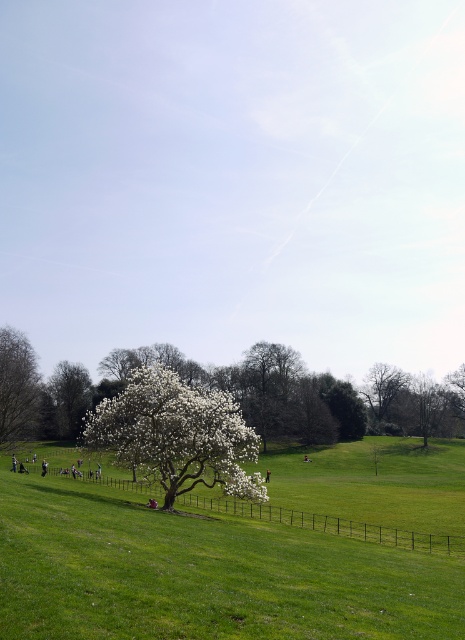
Does white textured tree at center-left have a lesser height compared to bare branches tree at upper right?

In fact, white textured tree at center-left may be taller than bare branches tree at upper right.

Does white textured tree at center-left have a larger size compared to bare branches tree at upper right?

No, white textured tree at center-left is not bigger than bare branches tree at upper right.

You are a GUI agent. You are given a task and a screenshot of the screen. Output one action in this format:
    pyautogui.click(x=<x>, y=<y>)
    Task: Click on the white textured tree at center-left
    
    Given the screenshot: What is the action you would take?
    pyautogui.click(x=70, y=396)

Is point (123, 394) positioned behind point (34, 408)?

Yes, it is behind point (34, 408).

Who is higher up, white fluffy blossoms at center or white textured tree at left?

white textured tree at left is higher up.

The width and height of the screenshot is (465, 640). Describe the element at coordinates (177, 435) in the screenshot. I see `white fluffy blossoms at center` at that location.

Identify the location of white fluffy blossoms at center. This screenshot has width=465, height=640. (177, 435).

Does green grassy field at center appear under white fluffy blossoms at center?

Yes.

How much distance is there between green grassy field at center and white fluffy blossoms at center?

They are 53.05 feet apart.

This screenshot has height=640, width=465. Describe the element at coordinates (203, 573) in the screenshot. I see `green grassy field at center` at that location.

The width and height of the screenshot is (465, 640). I want to click on green grassy field at center, so (203, 573).